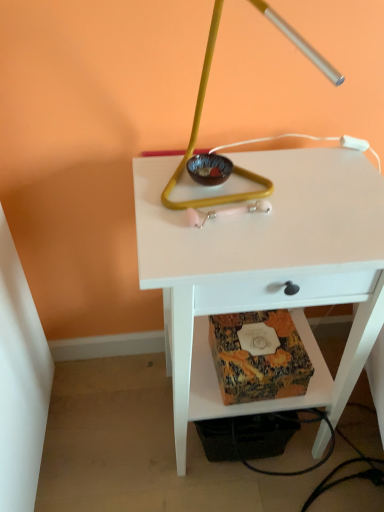
Question: Can you confirm if metallic gold lamp at center is taller than white matte table at center?

Choices:
 (A) no
 (B) yes

Answer: (A)

Question: Considering the relative sizes of metallic gold lamp at center and white matte table at center in the image provided, is metallic gold lamp at center shorter than white matte table at center?

Choices:
 (A) yes
 (B) no

Answer: (A)

Question: From the image's perspective, is metallic gold lamp at center over white matte table at center?

Choices:
 (A) no
 (B) yes

Answer: (B)

Question: Can you confirm if metallic gold lamp at center is positioned to the right of white matte table at center?

Choices:
 (A) no
 (B) yes

Answer: (A)

Question: Is metallic gold lamp at center next to white matte table at center and touching it?

Choices:
 (A) no
 (B) yes

Answer: (A)

Question: Is metallic gold lamp at center closer to camera compared to white matte table at center?

Choices:
 (A) yes
 (B) no

Answer: (A)

Question: Is matte brown glass bowl at center positioned with its back to patterned paper at lower center?

Choices:
 (A) yes
 (B) no

Answer: (B)

Question: Is matte brown glass bowl at center closer to the viewer compared to patterned paper at lower center?

Choices:
 (A) yes
 (B) no

Answer: (A)

Question: From a real-world perspective, is matte brown glass bowl at center below patterned paper at lower center?

Choices:
 (A) yes
 (B) no

Answer: (B)

Question: Is matte brown glass bowl at center thinner than patterned paper at lower center?

Choices:
 (A) yes
 (B) no

Answer: (A)

Question: Does matte brown glass bowl at center have a larger size compared to patterned paper at lower center?

Choices:
 (A) no
 (B) yes

Answer: (A)

Question: From the image's perspective, does matte brown glass bowl at center appear higher than patterned paper at lower center?

Choices:
 (A) no
 (B) yes

Answer: (B)

Question: From a real-world perspective, is patterned paper at lower center located higher than white matte table at center?

Choices:
 (A) yes
 (B) no

Answer: (B)